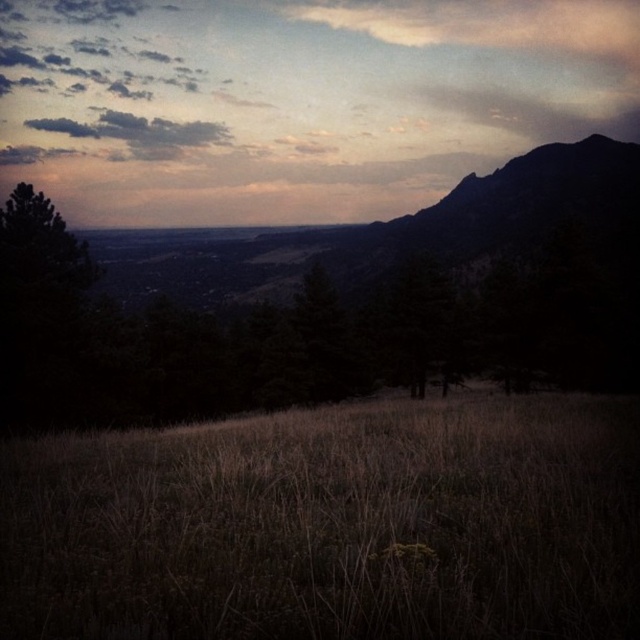
Question: Is matte sky at upper center bigger than dark gray cloud at upper left?

Choices:
 (A) no
 (B) yes

Answer: (B)

Question: Is dry grass at center wider than matte sky at upper center?

Choices:
 (A) no
 (B) yes

Answer: (A)

Question: Does dry grass at center appear over matte sky at upper center?

Choices:
 (A) yes
 (B) no

Answer: (B)

Question: Which is nearer to the dry grass at center?

Choices:
 (A) matte sky at upper center
 (B) dark gray cloud at upper left

Answer: (A)

Question: Which object is farther from the camera taking this photo?

Choices:
 (A) dry grass at center
 (B) matte sky at upper center

Answer: (B)

Question: Among these objects, which one is farthest from the camera?

Choices:
 (A) dark gray cloud at upper left
 (B) dry grass at center

Answer: (A)